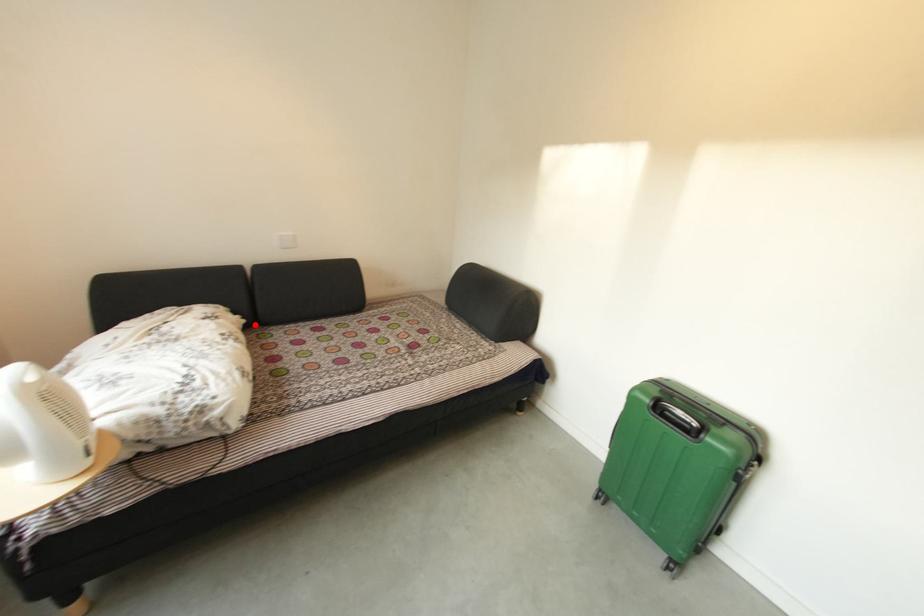
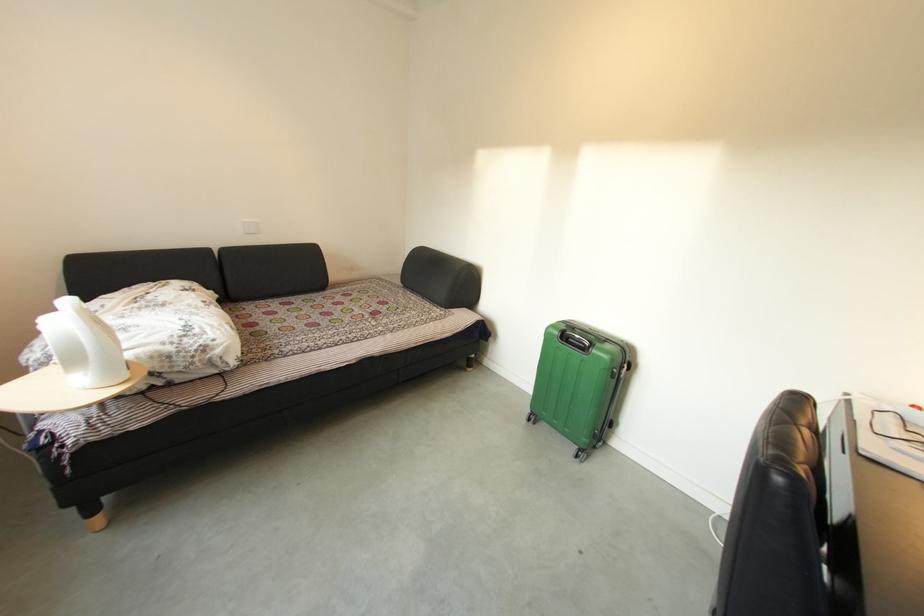
The point at the highlighted location is marked in the first image. Where is the corresponding point in the second image?

(228, 300)